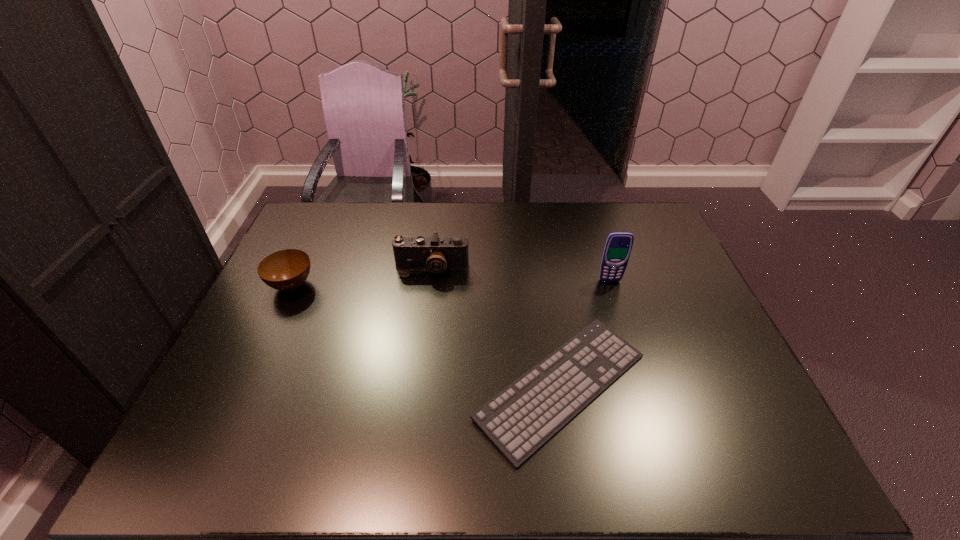
This screenshot has width=960, height=540. I want to click on object that is the closest to the computer keyboard, so click(618, 245).

Locate an element on the screen. free spot that satisfies the following two spatial constraints: 1. on the front-facing side of the camera; 2. on the left side of the computer keyboard is located at coordinates (418, 387).

Where is `free spot that satisfies the following two spatial constraints: 1. on the front-facing side of the computer keyboard; 2. on the left side of the second tallest object`? free spot that satisfies the following two spatial constraints: 1. on the front-facing side of the computer keyboard; 2. on the left side of the second tallest object is located at coordinates (418, 387).